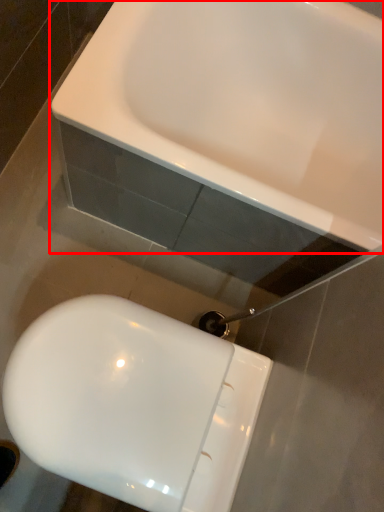
Question: In this image, where is sink (annotated by the red box) located relative to toilet?

Choices:
 (A) right
 (B) left

Answer: (A)